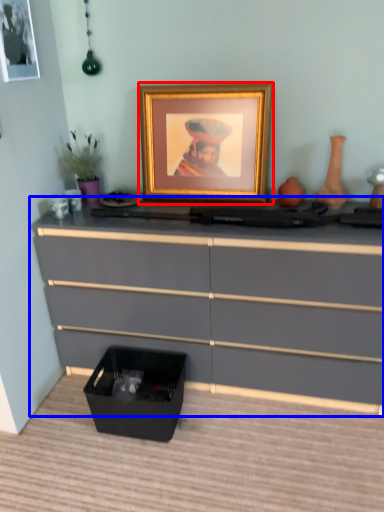
Question: Which object is further to the camera taking this photo, picture frame (highlighted by a red box) or chest of drawers (highlighted by a blue box)?

Choices:
 (A) picture frame
 (B) chest of drawers

Answer: (A)